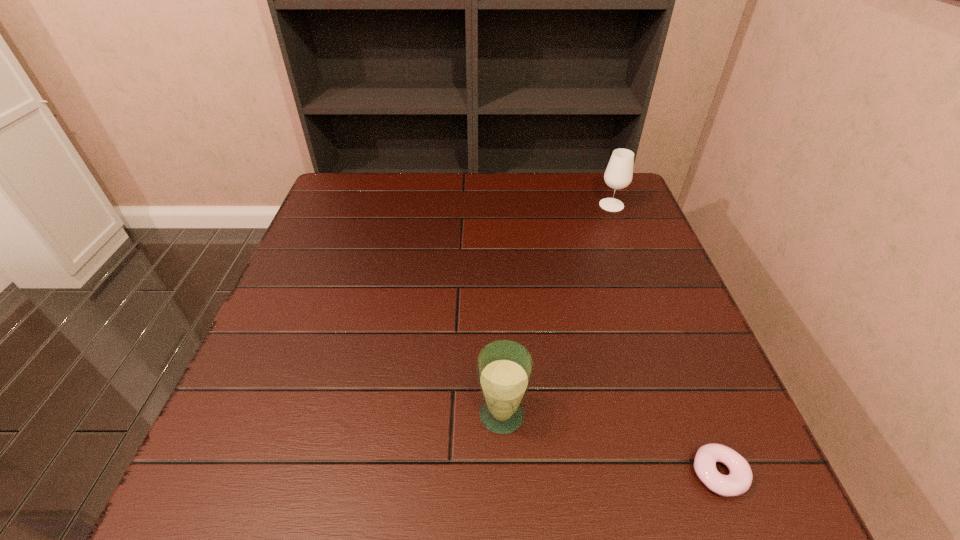
Identify the location of vacant space at the far right corner. The width and height of the screenshot is (960, 540). (630, 197).

This screenshot has width=960, height=540. I want to click on vacant region between the left glass and the farthest object, so click(x=557, y=309).

Locate an element on the screen. The image size is (960, 540). free spot between the farther glass and the doughnut is located at coordinates (665, 339).

Locate an element on the screen. empty location between the shortest object and the nearer glass is located at coordinates (611, 444).

Image resolution: width=960 pixels, height=540 pixels. In order to click on empty space between the farther glass and the nearer glass in this screenshot , I will do `click(557, 309)`.

You are a GUI agent. You are given a task and a screenshot of the screen. Output one action in this format:
    pyautogui.click(x=<x>, y=<y>)
    Task: Click on the unoccupied area between the shortest object and the right glass
    
    Given the screenshot: What is the action you would take?
    pyautogui.click(x=665, y=339)

You are a GUI agent. You are given a task and a screenshot of the screen. Output one action in this format:
    pyautogui.click(x=<x>, y=<y>)
    Task: Click on the vacant point located between the second nearest object and the doughnut
    The image size is (960, 540).
    Given the screenshot: What is the action you would take?
    pyautogui.click(x=611, y=444)

What are the coordinates of `free space between the second farthest object and the right glass` in the screenshot? It's located at (557, 309).

Find the location of `vacant area that lies between the farther glass and the nearer glass`. vacant area that lies between the farther glass and the nearer glass is located at coordinates (557, 309).

You are a GUI agent. You are given a task and a screenshot of the screen. Output one action in this format:
    pyautogui.click(x=<x>, y=<y>)
    Task: Click on the empty space between the right glass and the doughnut
    The width and height of the screenshot is (960, 540).
    Given the screenshot: What is the action you would take?
    pyautogui.click(x=665, y=339)